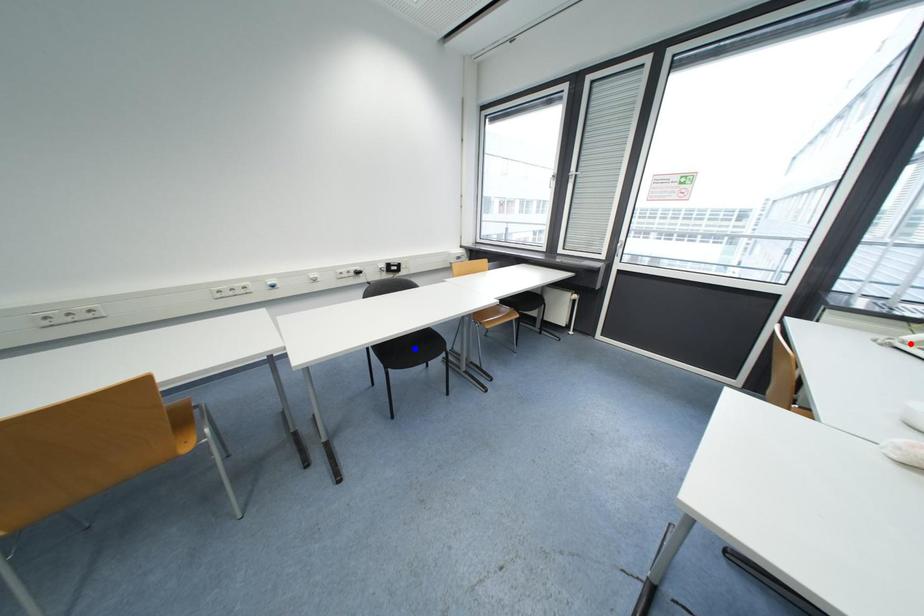
Question: Two points are marked on the image. Which point is closer to the camera?

Choices:
 (A) Blue point is closer.
 (B) Red point is closer.

Answer: (B)